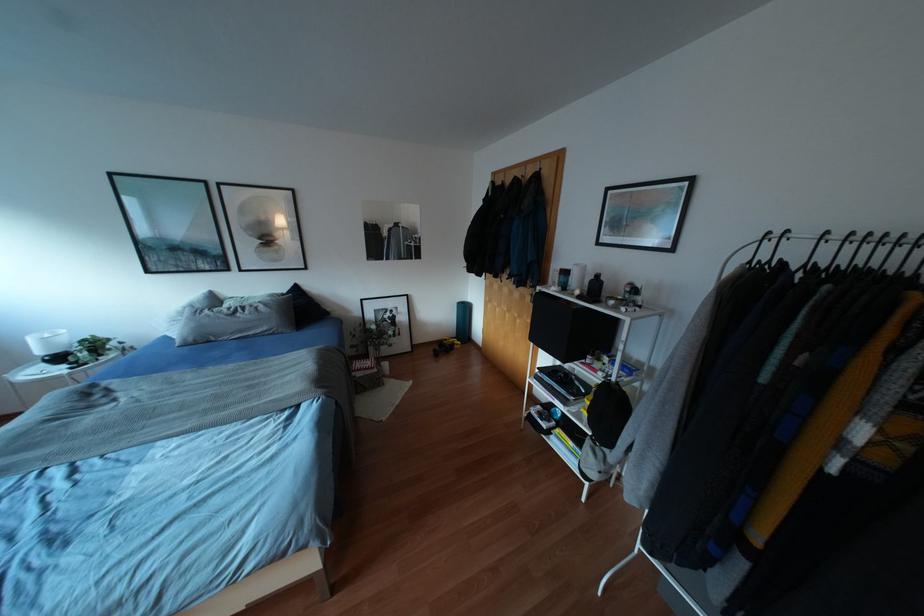
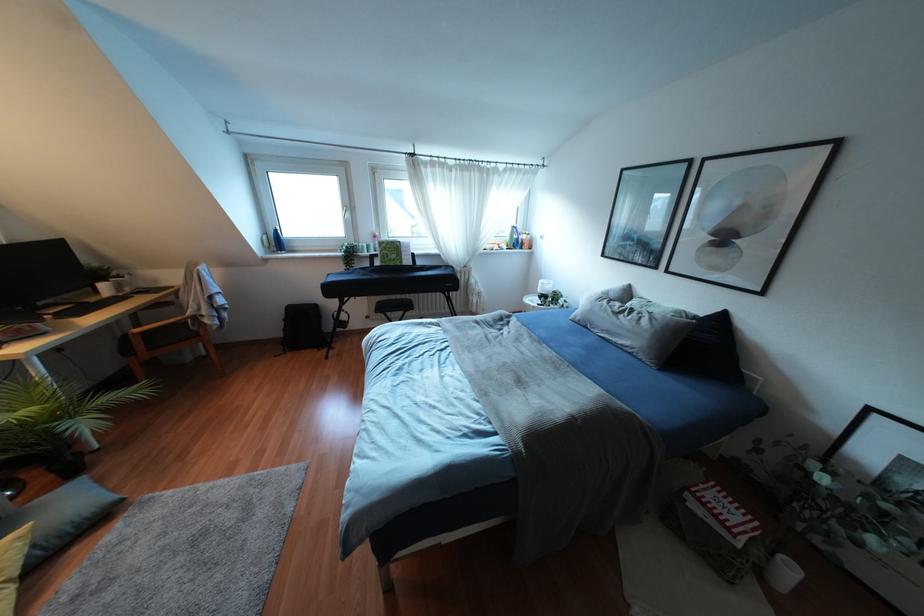
Locate, in the second image, the point that corresponds to point (296, 288) in the first image.

(722, 317)